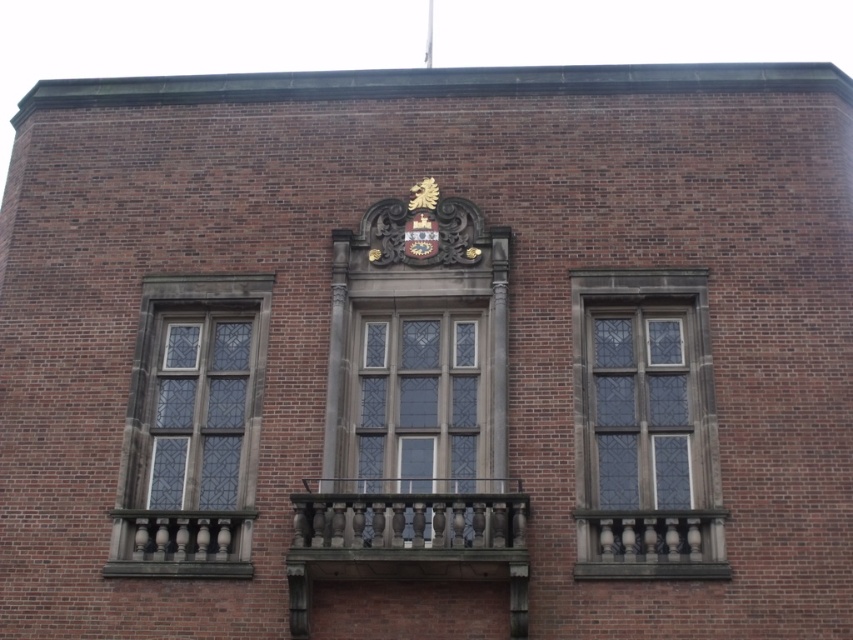
Is brown polished wood balcony at center in front of clear glass window at center?

That is True.

Who is taller, brown polished wood balcony at center or clear glass window at center?

clear glass window at center is taller.

From the picture: Measure the distance between point [355,545] and camera.

The distance of point [355,545] from camera is 39.61 meters.

This screenshot has height=640, width=853. What are the coordinates of `brown polished wood balcony at center` in the screenshot? It's located at (407, 538).

Does stained glass window at center come in front of clear glass window at left?

Yes, it is in front of clear glass window at left.

Which of these two, stained glass window at center or clear glass window at left, stands shorter?

With less height is stained glass window at center.

Describe the element at coordinates (645, 426) in the screenshot. I see `stained glass window at center` at that location.

Find the location of a particular element. The width and height of the screenshot is (853, 640). stained glass window at center is located at coordinates (645, 426).

Does stained glass window at center appear over clear glass window at center?

Yes, stained glass window at center is above clear glass window at center.

Image resolution: width=853 pixels, height=640 pixels. What are the coordinates of `stained glass window at center` in the screenshot? It's located at (645, 426).